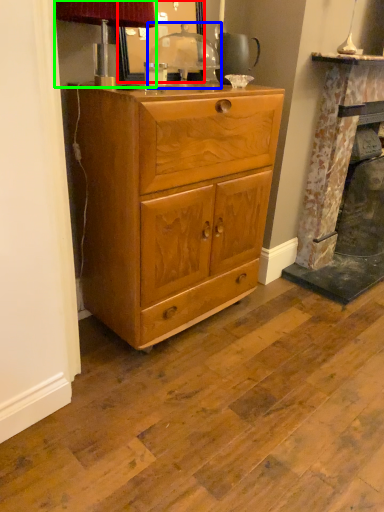
Question: Estimate the real-world distances between objects in this image. Which object is closer to mirror (highlighted by a red box), table lamp (highlighted by a blue box) or table lamp (highlighted by a green box)?

Choices:
 (A) table lamp
 (B) table lamp

Answer: (A)